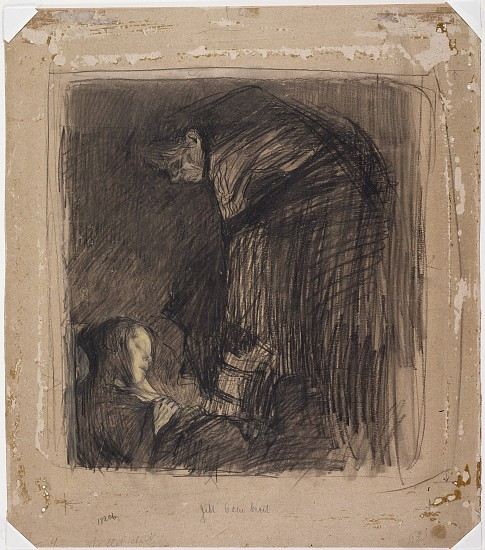
Image resolution: width=485 pixels, height=550 pixels. What are the coordinates of `door frame` in the screenshot? It's located at (166, 404), (312, 60), (452, 384), (42, 233).